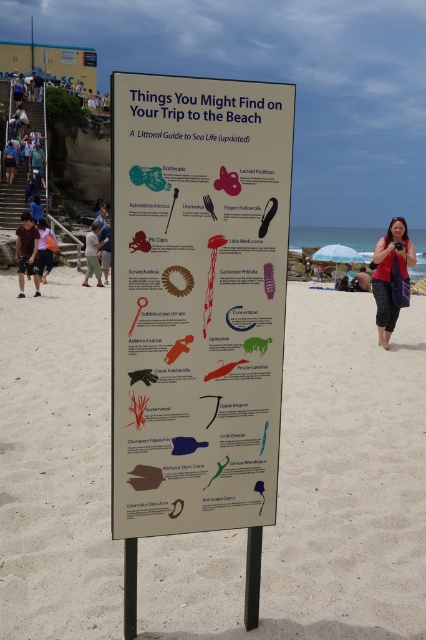
Does white paper sign at center appear on the right side of light brown fabric pants at center?

Correct, you'll find white paper sign at center to the right of light brown fabric pants at center.

From the picture: Between white paper sign at center and light brown fabric pants at center, which one has more height?

light brown fabric pants at center is taller.

Is point (184, 385) positioned in front of point (97, 232)?

Yes.

Identify the location of white paper sign at center. The image size is (426, 640). (196, 300).

Does white sand at center appear on the left side of red fabric bag at center?

Indeed, white sand at center is positioned on the left side of red fabric bag at center.

Who is more distant from viewer, (419, 321) or (365, 276)?

Positioned behind is point (365, 276).

Is point (203, 614) positioned in front of point (367, 273)?

Yes, point (203, 614) is closer to viewer.

Locate an element on the screen. The width and height of the screenshot is (426, 640). white sand at center is located at coordinates pos(319,497).

Between point (397, 232) and point (359, 291), which one is positioned behind?

The point (359, 291) is behind.

Is red fabric bag at right positioned before red fabric bag at center?

Yes, red fabric bag at right is in front of red fabric bag at center.

Which is in front, point (414, 260) or point (362, 273)?

Point (414, 260) is in front.

The height and width of the screenshot is (640, 426). In order to click on red fabric bag at right in this screenshot , I will do 389,275.